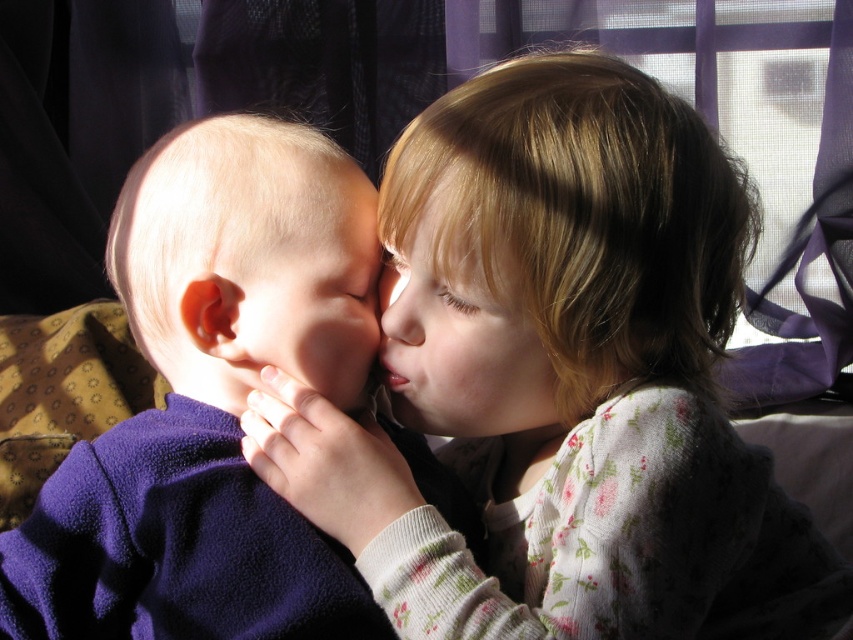
How distant is smooth skin face at center from smooth skin nose at center?

They are 2.03 inches apart.

Between smooth skin face at center and smooth skin nose at center, which one has more height?

With more height is smooth skin face at center.

You are a GUI agent. You are given a task and a screenshot of the screen. Output one action in this format:
    pyautogui.click(x=<x>, y=<y>)
    Task: Click on the smooth skin face at center
    The width and height of the screenshot is (853, 640).
    Given the screenshot: What is the action you would take?
    pyautogui.click(x=317, y=292)

Who is higher up, soft purple fleece at left or smooth skin nose at center?

smooth skin nose at center is above.

Between soft purple fleece at left and smooth skin nose at center, which one appears on the right side from the viewer's perspective?

smooth skin nose at center

Locate an element on the screen. The width and height of the screenshot is (853, 640). soft purple fleece at left is located at coordinates (212, 401).

Which of these two, blonde hair at upper right or smooth skin nose at center, stands shorter?

smooth skin nose at center

Is blonde hair at upper right closer to the viewer compared to smooth skin nose at center?

Yes, it is in front of smooth skin nose at center.

Find the location of a particular element. blonde hair at upper right is located at coordinates (460, 332).